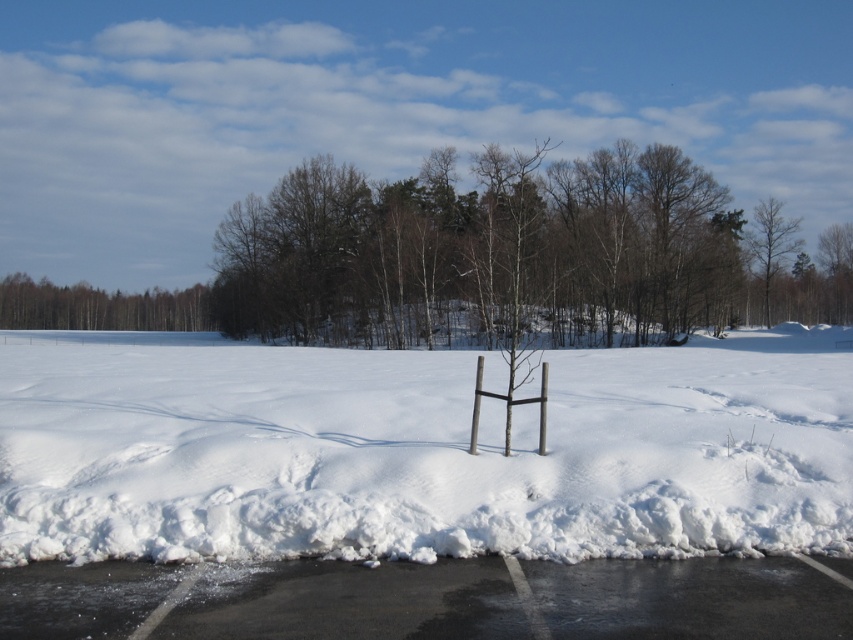
Question: Which of the following is the farthest from the observer?

Choices:
 (A) brown wood tree at upper left
 (B) bare wood tree at upper right
 (C) white fluffy snow at center
 (D) black asphalt parking lot at lower center

Answer: (A)

Question: Which is nearer to the bare wood tree at upper right?

Choices:
 (A) brown wood tree at upper left
 (B) white fluffy snow at center

Answer: (B)

Question: Is white fluffy snow at center bigger than black asphalt parking lot at lower center?

Choices:
 (A) no
 (B) yes

Answer: (B)

Question: Does white fluffy snow at center have a larger size compared to bare wood tree at upper right?

Choices:
 (A) yes
 (B) no

Answer: (A)

Question: Is white fluffy snow at center thinner than brown wood tree at upper left?

Choices:
 (A) yes
 (B) no

Answer: (B)

Question: Which point is farther from the camera taking this photo?

Choices:
 (A) (128, 518)
 (B) (4, 618)
 (C) (103, 321)

Answer: (C)